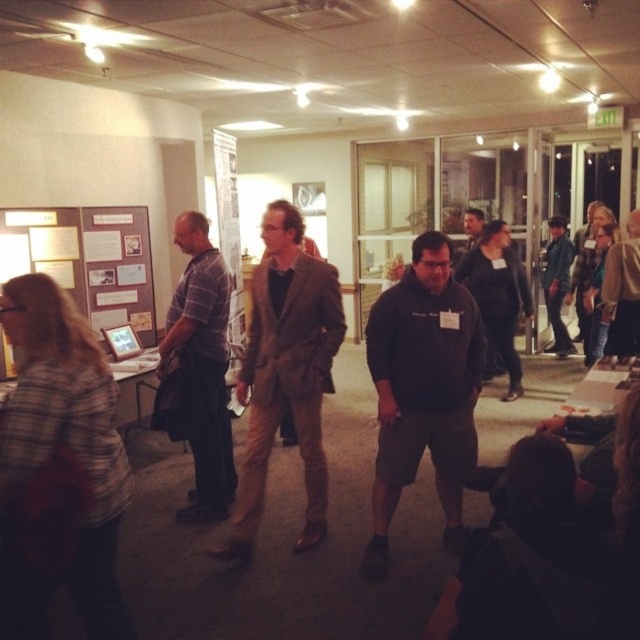
Question: Estimate the real-world distances between objects in this image. Which object is closer to the brown leather jacket at center?

Choices:
 (A) brown wool blazer at center
 (B) striped cotton shirt at left

Answer: (A)

Question: Is brown wool blazer at center positioned in front of striped cotton shirt at left?

Choices:
 (A) yes
 (B) no

Answer: (A)

Question: Which object is the farthest from the brown wool blazer at center?

Choices:
 (A) dark gray hoodie at center
 (B) denim jacket at right

Answer: (B)

Question: From the image, what is the correct spatial relationship of dark gray hoodie at center in relation to denim jacket at right?

Choices:
 (A) left
 (B) right

Answer: (A)

Question: Estimate the real-world distances between objects in this image. Which object is closer to the brown wool blazer at center?

Choices:
 (A) striped cotton shirt at left
 (B) denim jacket at right

Answer: (A)

Question: Can you confirm if dark gray hoodie at center is thinner than striped cotton shirt at left?

Choices:
 (A) no
 (B) yes

Answer: (A)